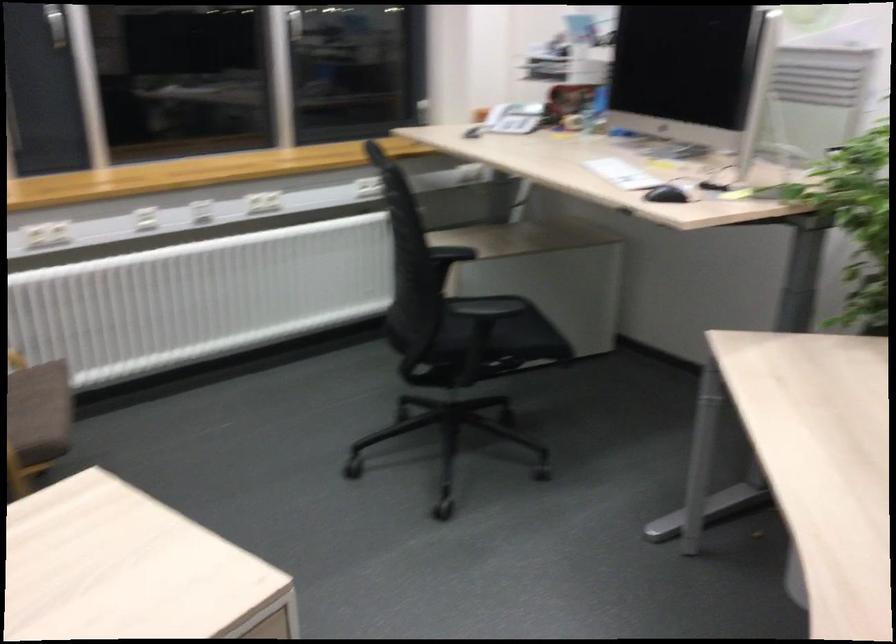
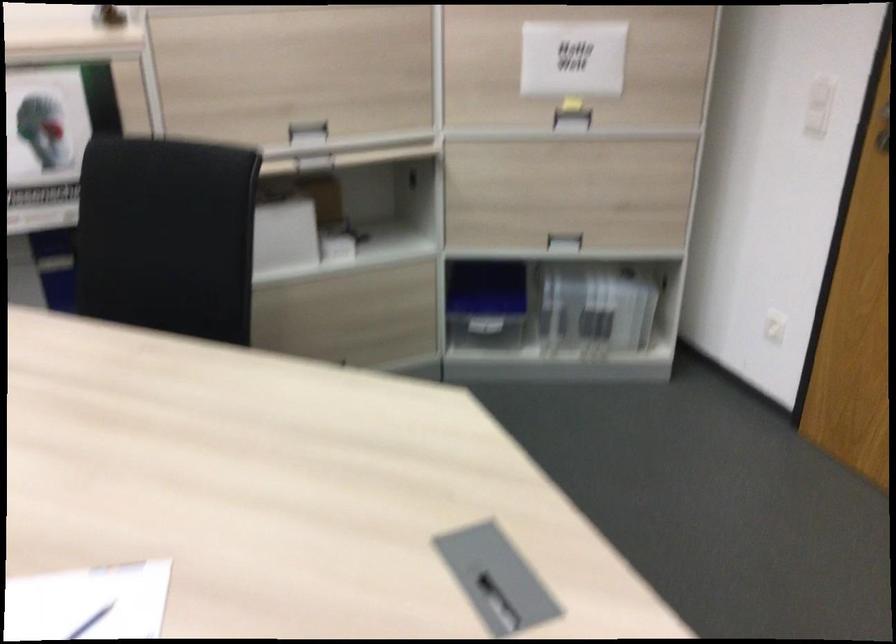
The images are taken continuously from a first-person perspective. In which direction is your viewpoint rotating?

The rotation direction of the camera is right-down.